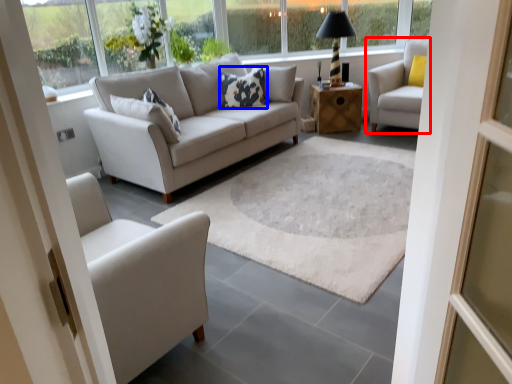
Question: Which point is further to the camera, chair (highlighted by a red box) or pillow (highlighted by a blue box)?

Choices:
 (A) chair
 (B) pillow

Answer: (B)